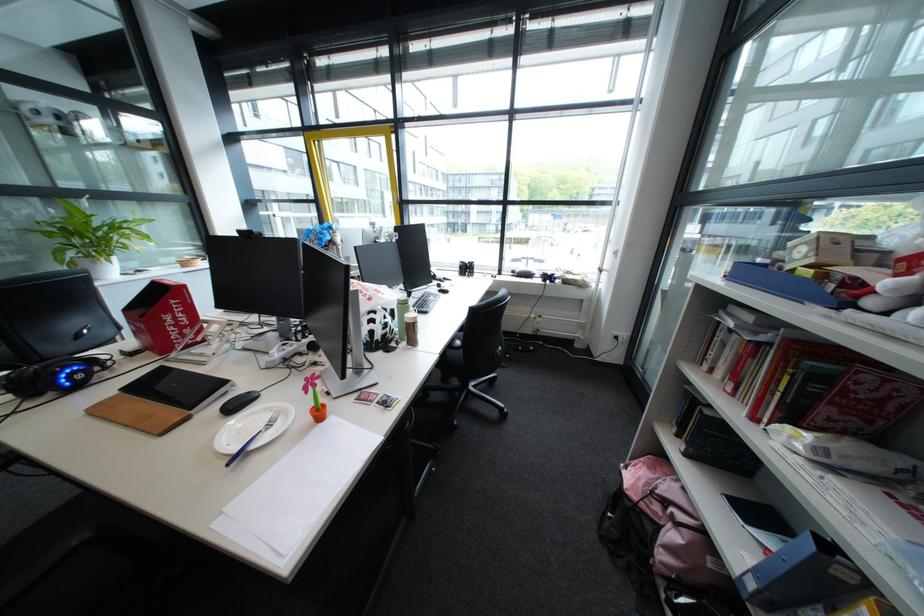
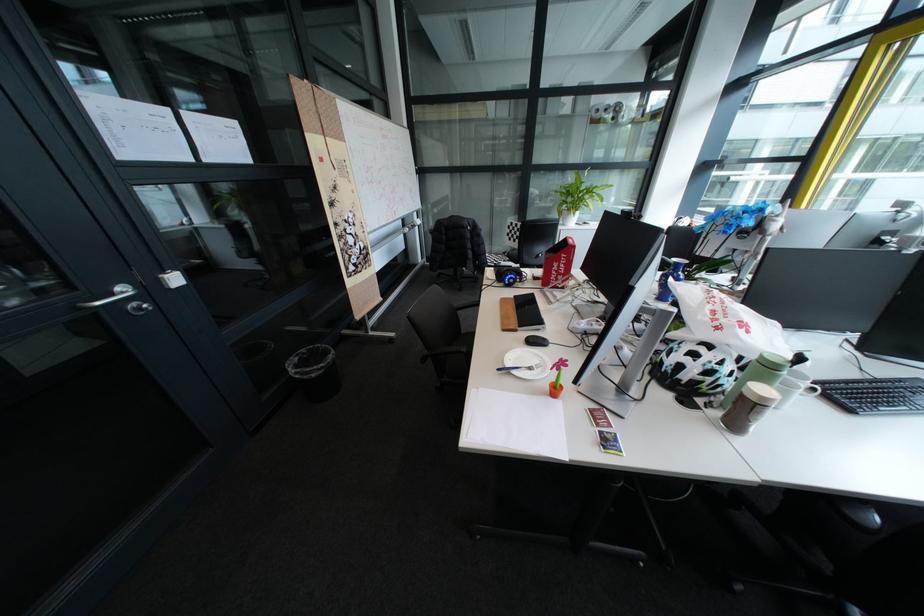
Find the pixel in the second image that matches the point at 388,323 in the first image.

(709, 361)